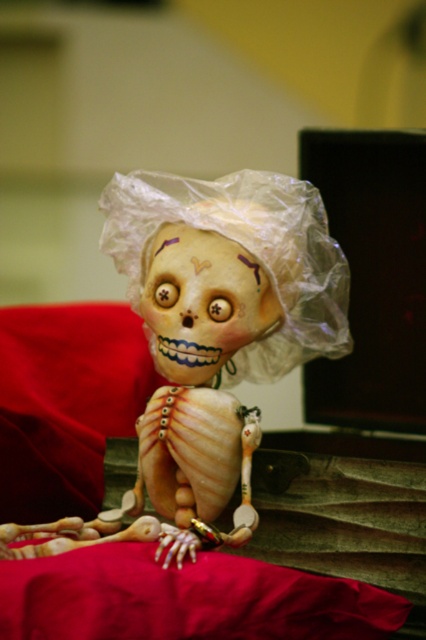
Can you confirm if matte plastic zombie at center is shorter than transparent plastic doll at center?

No, matte plastic zombie at center is not shorter than transparent plastic doll at center.

This screenshot has width=426, height=640. I want to click on matte plastic zombie at center, so click(210, 330).

This screenshot has width=426, height=640. What are the coordinates of `matte plastic zombie at center` in the screenshot? It's located at (210, 330).